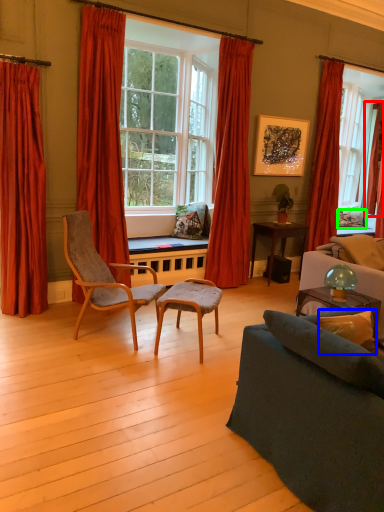
Question: Which object is the closest to the curtain (highlighted by a red box)? Choose among these: pillow (highlighted by a blue box) or pillow (highlighted by a green box).

Choices:
 (A) pillow
 (B) pillow

Answer: (B)